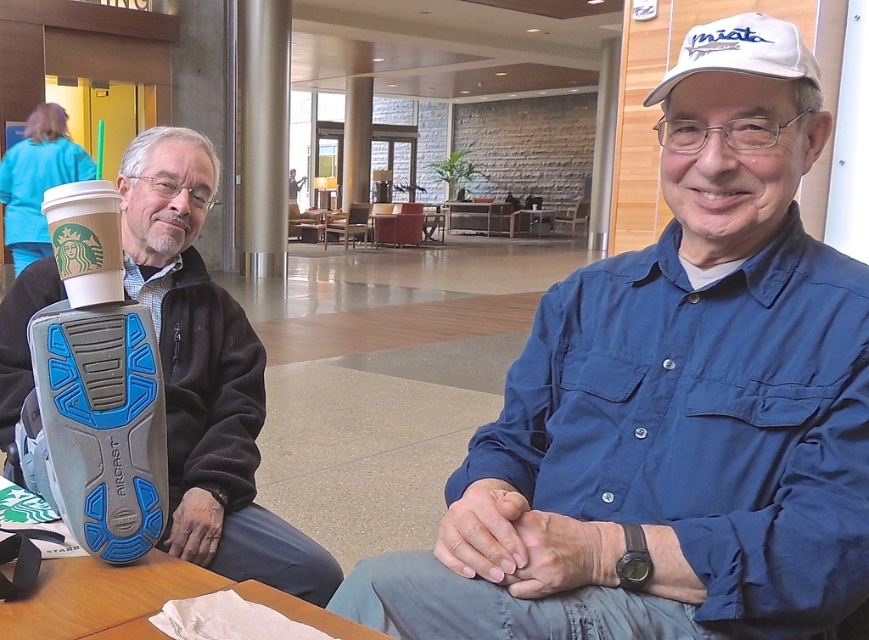
Does matte black shoe at left have a lesser height compared to white fabric baseball cap at upper right?

No.

Measure the distance between point (251,420) and camera.

Point (251,420) and camera are 5.74 feet apart.

The image size is (869, 640). I want to click on matte black shoe at left, so click(x=206, y=376).

Can you confirm if white paper cup at upper left is shorter than white fabric baseball cap at upper right?

Incorrect, white paper cup at upper left's height does not fall short of white fabric baseball cap at upper right's.

Can you confirm if white paper cup at upper left is positioned above white fabric baseball cap at upper right?

Incorrect, white paper cup at upper left is not positioned above white fabric baseball cap at upper right.

Does point (52, 195) come farther from viewer compared to point (704, 64)?

Yes, point (52, 195) is farther from viewer.

Find the location of a particular element. white paper cup at upper left is located at coordinates (85, 241).

Between point (173, 138) and point (97, 289), which one is positioned in front?

Point (97, 289)

Does matte black shoe at left have a smaller size compared to white paper cup at upper left?

Incorrect, matte black shoe at left is not smaller in size than white paper cup at upper left.

Who is more forward, (x=41, y=296) or (x=111, y=257)?

Positioned in front is point (x=111, y=257).

Locate an element on the screen. This screenshot has height=640, width=869. matte black shoe at left is located at coordinates (206, 376).